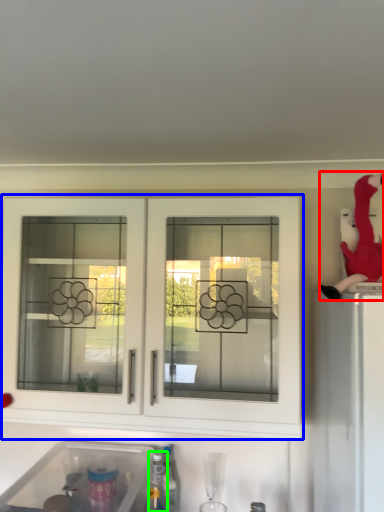
Question: Which is farther away from person (highlighted by a red box)? cabinetry (highlighted by a blue box) or bottle (highlighted by a green box)?

Choices:
 (A) cabinetry
 (B) bottle

Answer: (B)